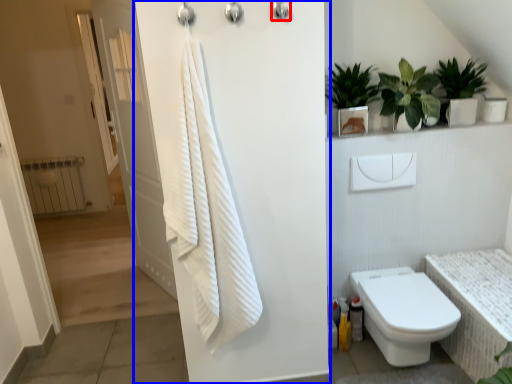
Question: Which object is further to the camera taking this photo, shower (highlighted by a red box) or screen door (highlighted by a blue box)?

Choices:
 (A) shower
 (B) screen door

Answer: (A)